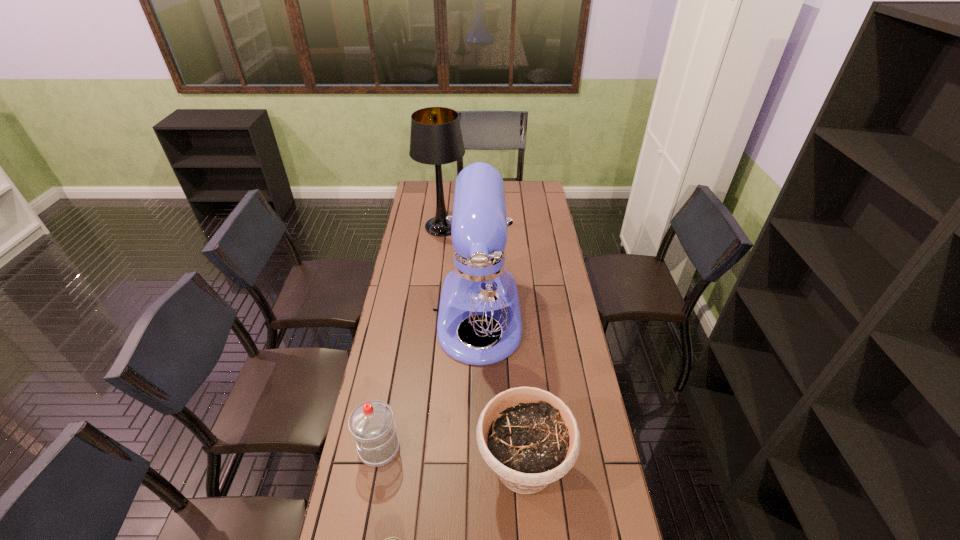
Locate an element on the screen. The image size is (960, 540). vacant space at the far edge of the desktop is located at coordinates (454, 192).

This screenshot has height=540, width=960. What are the coordinates of `vacant region at the left edge of the desktop` in the screenshot? It's located at (407, 354).

Identify the location of vacant space at the right edge of the desktop. Image resolution: width=960 pixels, height=540 pixels. (596, 479).

Locate an element on the screen. This screenshot has width=960, height=540. vacant position at the far left corner of the desktop is located at coordinates (420, 184).

The image size is (960, 540). Identify the location of free space at the far right corner of the desktop. (539, 188).

This screenshot has height=540, width=960. I want to click on vacant area that lies between the farthest object and the water bottle, so click(411, 338).

You are a GUI agent. You are given a task and a screenshot of the screen. Output one action in this format:
    pyautogui.click(x=<x>, y=<y>)
    Task: Click on the unoccupied area between the mixer and the water bottle
    The height and width of the screenshot is (540, 960).
    Given the screenshot: What is the action you would take?
    pyautogui.click(x=429, y=382)

I want to click on vacant area between the farthest object and the water bottle, so click(411, 338).

Locate which object ranks second in proximity to the flowerpot. Please provide its 2D coordinates. Your answer should be formatted as a tuple, i.e. [(x, y)], where the tuple contains the x and y coordinates of a point satisfying the conditions above.

[(479, 290)]

Where is `object that is the third closest to the water bottle`? object that is the third closest to the water bottle is located at coordinates (528, 436).